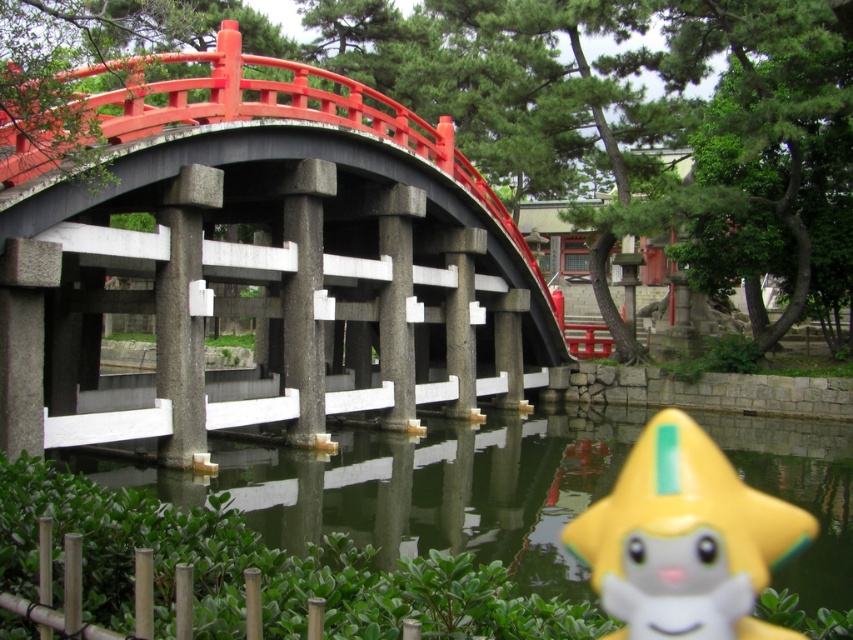
Between point (62, 401) and point (839, 557), which one is positioned behind?

The point (62, 401) is more distant.

Is point (57, 179) more distant than point (343, 451)?

No, (57, 179) is in front of (343, 451).

You are a GUI agent. You are given a task and a screenshot of the screen. Output one action in this format:
    pyautogui.click(x=<x>, y=<y>)
    Task: Click on the smooth stone bridge at center
    This screenshot has width=853, height=640.
    Given the screenshot: What is the action you would take?
    click(257, 257)

Between green matte water at lower center and yellow matte star at lower right, which one appears on the right side from the viewer's perspective?

yellow matte star at lower right is more to the right.

Is point (73, 461) positioned after point (718, 563)?

Yes, it is.

The height and width of the screenshot is (640, 853). Identify the location of green matte water at lower center. click(416, 486).

Does smooth stone bridge at center have a greater height compared to yellow matte star at lower right?

Yes, smooth stone bridge at center is taller than yellow matte star at lower right.

Does smooth stone bridge at center have a smaller size compared to yellow matte star at lower right?

Actually, smooth stone bridge at center might be larger than yellow matte star at lower right.

Between point (3, 387) and point (625, 625), which one is positioned behind?

Point (3, 387)

Where is `smooth stone bridge at center`? Image resolution: width=853 pixels, height=640 pixels. smooth stone bridge at center is located at coordinates (257, 257).